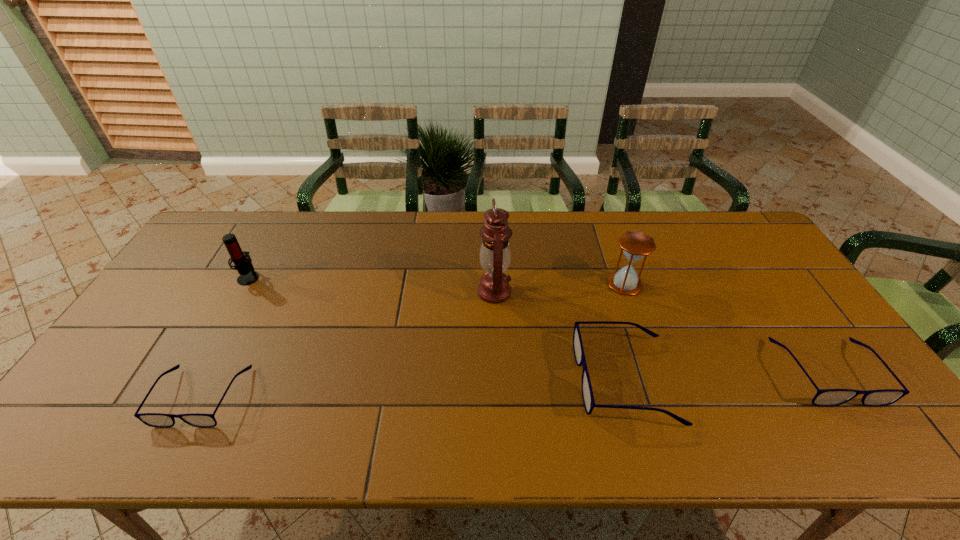
You are a GUI agent. You are given a task and a screenshot of the screen. Output one action in this format:
    pyautogui.click(x=<x>, y=<y>)
    Task: Click on the shortest object
    The height and width of the screenshot is (540, 960).
    Given the screenshot: What is the action you would take?
    pyautogui.click(x=159, y=420)

Image resolution: width=960 pixels, height=540 pixels. Identify the location of the shortest spectacles. (159, 420).

Locate an element on the screen. This screenshot has width=960, height=540. the second spectacles from right to left is located at coordinates (587, 393).

Locate an element on the screen. This screenshot has height=540, width=960. the fifth tallest object is located at coordinates (825, 397).

At what (x,y) coordinates should I click in order to perform the action: click on the rightmost object. Please return your answer as a coordinate pair (x, y). Looking at the image, I should click on (825, 397).

At what (x,y) coordinates should I click in order to perform the action: click on microphone. Please return your answer as a coordinate pair (x, y). The image size is (960, 540). Looking at the image, I should click on (243, 265).

Identify the location of hourglass. (636, 245).

This screenshot has height=540, width=960. I want to click on the third object from left to right, so (x=495, y=255).

Identify the location of oil lamp. pyautogui.click(x=495, y=255).

Identify the location of free space located 0.150m on the front-facing side of the second spectacles from right to left. (517, 380).